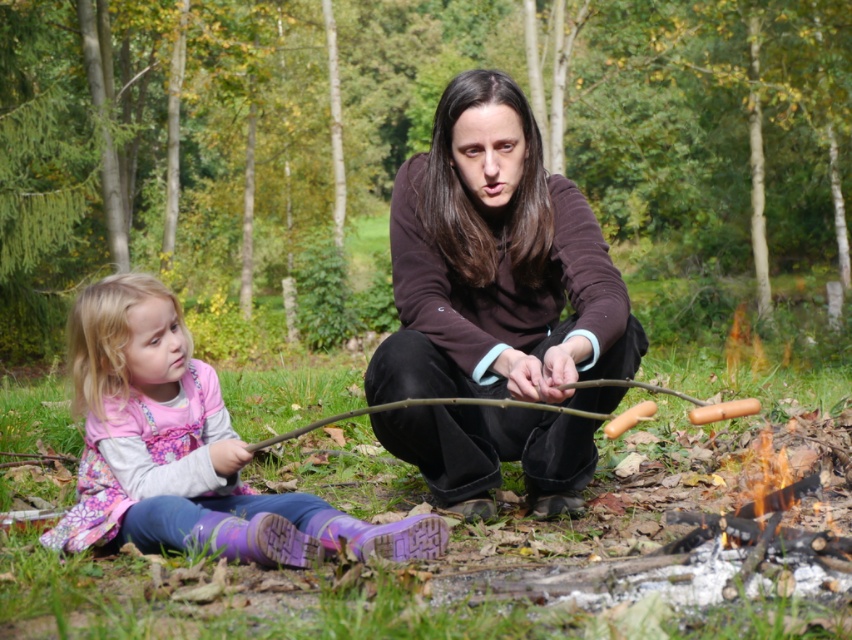
Who is positioned more to the left, brown matte sweater at center or brown smooth stick at center?

From the viewer's perspective, brown smooth stick at center appears more on the left side.

Does brown matte sweater at center appear under brown smooth stick at center?

Actually, brown matte sweater at center is above brown smooth stick at center.

Where is `brown matte sweater at center`? The height and width of the screenshot is (640, 852). brown matte sweater at center is located at coordinates tap(498, 266).

I want to click on brown matte sweater at center, so click(498, 266).

Does brown matte sweater at center appear on the right side of pink floral dress at left?

Indeed, brown matte sweater at center is positioned on the right side of pink floral dress at left.

Which is above, brown matte sweater at center or pink floral dress at left?

Positioned higher is brown matte sweater at center.

Which is behind, point (550, 476) or point (234, 472)?

Positioned behind is point (550, 476).

The height and width of the screenshot is (640, 852). I want to click on brown matte sweater at center, so click(x=498, y=266).

Does pink floral dress at left appear under brown smooth stick at center?

Correct, pink floral dress at left is located below brown smooth stick at center.

What do you see at coordinates (185, 449) in the screenshot? I see `pink floral dress at left` at bounding box center [185, 449].

Does point (217, 548) come in front of point (452, 400)?

That is False.

Locate an element on the screen. The width and height of the screenshot is (852, 640). pink floral dress at left is located at coordinates (185, 449).